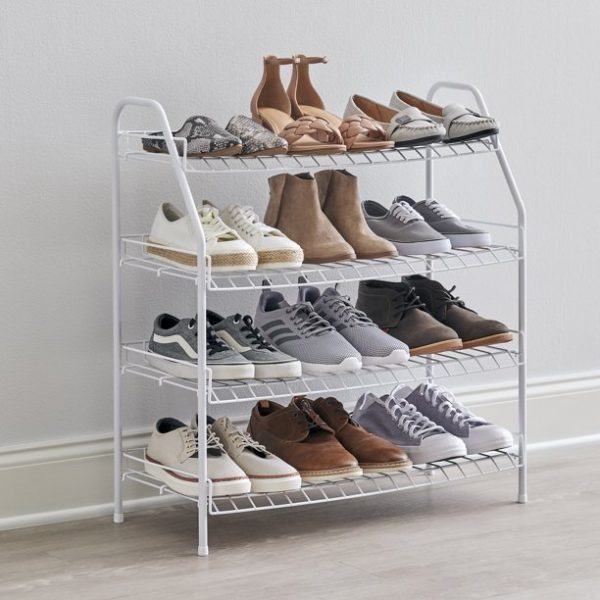
You are a GUI agent. You are given a task and a screenshot of the screen. Output one action in this format:
    pyautogui.click(x=<x>, y=<y>)
    Task: Click on the shoes on third shelf
    The height and width of the screenshot is (600, 600).
    Given the screenshot: What is the action you would take?
    pyautogui.click(x=467, y=319), pyautogui.click(x=426, y=324), pyautogui.click(x=371, y=335), pyautogui.click(x=322, y=343), pyautogui.click(x=274, y=364), pyautogui.click(x=230, y=362)